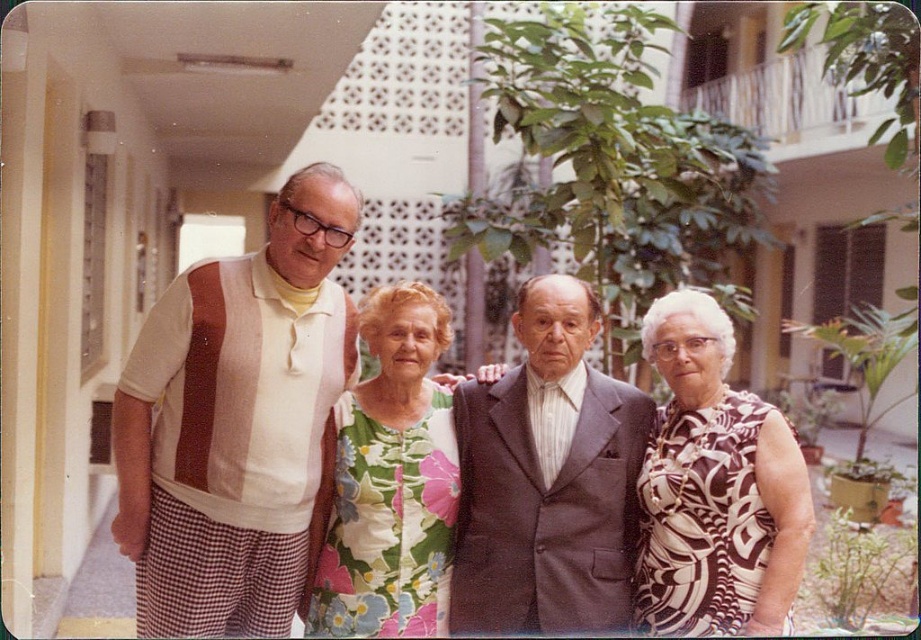
Who is lower down, floral fabric blouse at center or striped cotton shirt at center?

floral fabric blouse at center is below.

Between floral fabric blouse at center and striped cotton shirt at center, which one has more height?

striped cotton shirt at center is taller.

Locate an element on the screen. The image size is (921, 640). floral fabric blouse at center is located at coordinates (239, 422).

Which is in front, point (333, 307) or point (418, 461)?

Point (418, 461) is in front.

Is floral fabric blouse at center above floral fabric dress at center?

Yes, floral fabric blouse at center is above floral fabric dress at center.

Identify the location of floral fabric blouse at center. This screenshot has height=640, width=921. (239, 422).

This screenshot has width=921, height=640. I want to click on floral fabric blouse at center, so click(x=239, y=422).

From the picture: Can you confirm if dark gray suit at center is bigger than floral fabric dress at center?

Yes.

Is point (580, 328) more distant than point (391, 490)?

Yes.

Locate an element on the screen. This screenshot has height=640, width=921. dark gray suit at center is located at coordinates [546, 477].